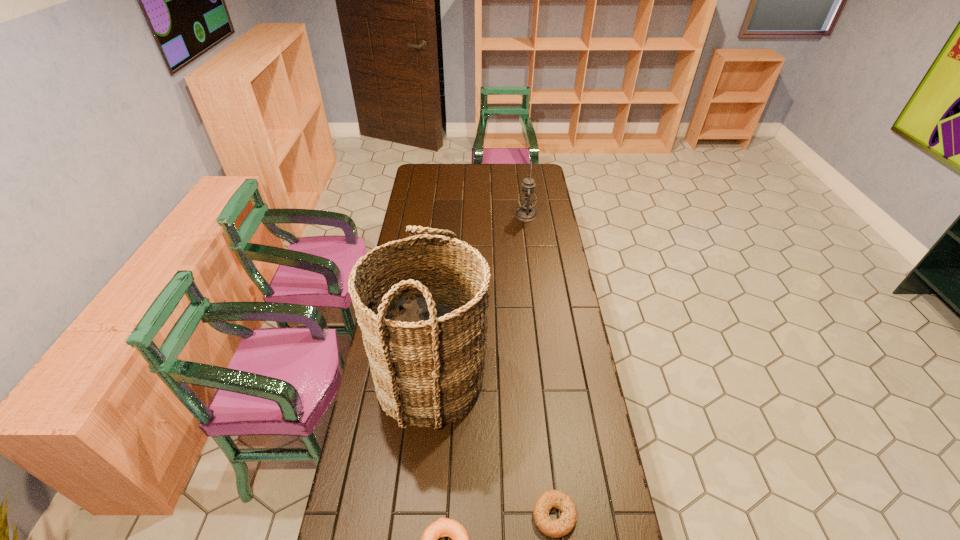
Locate an element on the screen. free space at the far left corner of the desktop is located at coordinates (430, 180).

Where is `the second closest object to the third shortest object`? The image size is (960, 540). the second closest object to the third shortest object is located at coordinates (557, 528).

Select which object is the third closest to the right bagel. Please provide its 2D coordinates. Your answer should be formatted as a tuple, i.e. [(x, y)], where the tuple contains the x and y coordinates of a point satisfying the conditions above.

[(527, 199)]